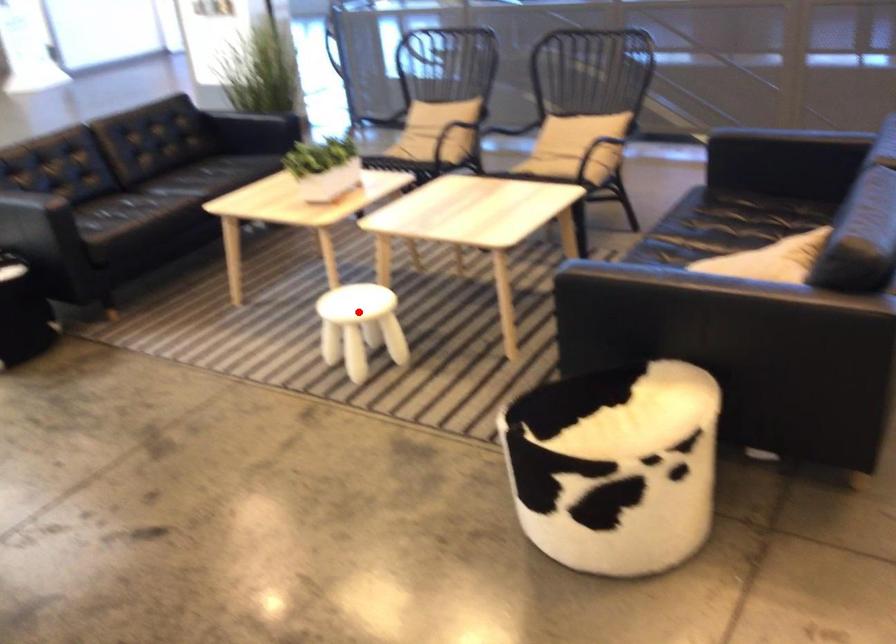
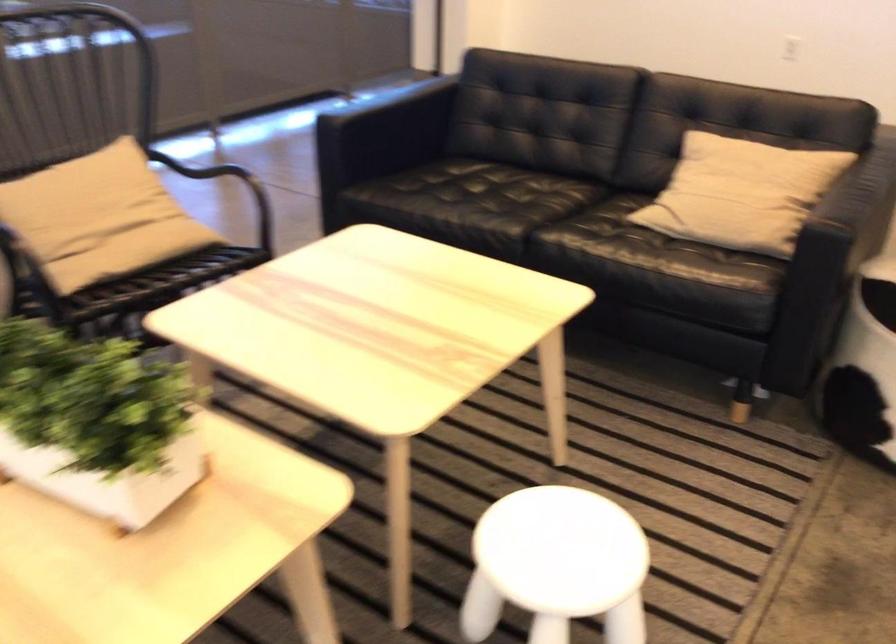
Where in the second image is the point corresponding to the highlighted location from the first image?

(556, 565)